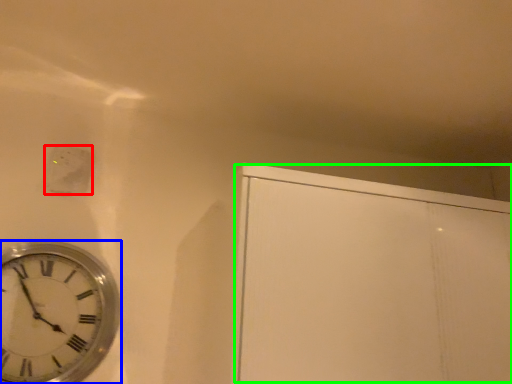
Question: Which object is positioned closest to electric outlet (highlighted by a red box)? Select from wall clock (highlighted by a blue box) and glass door (highlighted by a green box).

Choices:
 (A) wall clock
 (B) glass door

Answer: (A)